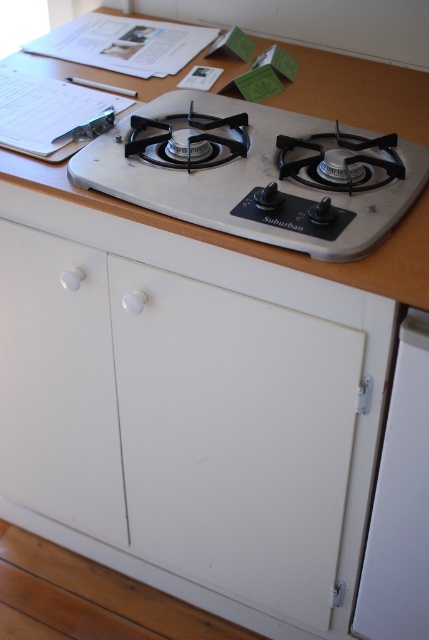
From the picture: Who is higher up, white plastic gas stove at center or wooden table at upper center?

wooden table at upper center

Is point (359, 208) closer to viewer compared to point (18, 182)?

Yes.

Does point (384, 168) lie in front of point (148, 220)?

That is False.

This screenshot has height=640, width=429. Identify the location of white plastic gas stove at center. (256, 172).

Is white plastic gas stove at center smaller than white plastic knob at center?

Incorrect, white plastic gas stove at center is not smaller in size than white plastic knob at center.

Can you confirm if white plastic gas stove at center is thinner than white plastic knob at center?

No, white plastic gas stove at center is not thinner than white plastic knob at center.

Who is more forward, (365, 253) or (126, 304)?

Point (365, 253) is in front.

Locate an element on the screen. This screenshot has height=640, width=429. white plastic gas stove at center is located at coordinates (256, 172).

Between white plastic knob at center and white plastic knob at lower left, which one has more height?

white plastic knob at lower left

Who is shorter, white plastic knob at center or white plastic knob at lower left?

white plastic knob at center is shorter.

Locate an element on the screen. The image size is (429, 640). white plastic knob at center is located at coordinates (133, 301).

Locate an element on the screen. white plastic knob at center is located at coordinates (133, 301).